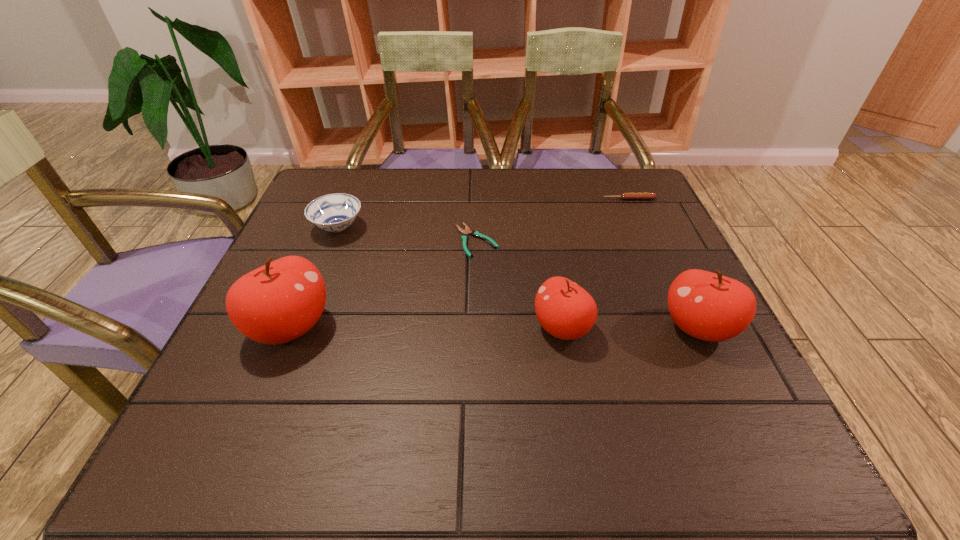
This screenshot has width=960, height=540. Find the location of `vacant space at the far right corner of the desktop`. vacant space at the far right corner of the desktop is located at coordinates (626, 175).

Image resolution: width=960 pixels, height=540 pixels. I want to click on empty space that is in between the second apple from right to left and the rightmost apple, so click(630, 328).

You are a GUI agent. You are given a task and a screenshot of the screen. Output one action in this format:
    pyautogui.click(x=<x>, y=<y>)
    Task: Click on the free space that is in between the second apple from left to right and the soup bowl
    Image resolution: width=960 pixels, height=540 pixels.
    Given the screenshot: What is the action you would take?
    pyautogui.click(x=450, y=278)

Identify the location of free spot between the leftmost apple and the pliers. This screenshot has height=540, width=960. tap(384, 284).

In order to click on empty space that is in between the leftmost apple and the second apple from right to left in this screenshot , I will do `click(426, 327)`.

Where is `free point between the second apple from right to left and the shortest object`? free point between the second apple from right to left and the shortest object is located at coordinates (519, 284).

The height and width of the screenshot is (540, 960). What are the coordinates of `vacant space that's between the second tallest object and the third object from right to left` in the screenshot? It's located at (630, 328).

Identify the location of free space between the leftmost apple and the third object from right to left. The height and width of the screenshot is (540, 960). [x=426, y=327].

Locate an element on the screen. free area in between the second apple from left to right and the rightmost apple is located at coordinates (630, 328).

You are a GUI agent. You are given a task and a screenshot of the screen. Output one action in this format:
    pyautogui.click(x=<x>, y=<y>)
    Task: Click on the vacant space in between the sausage and the pliers
    The width and height of the screenshot is (960, 540).
    Given the screenshot: What is the action you would take?
    pyautogui.click(x=553, y=220)